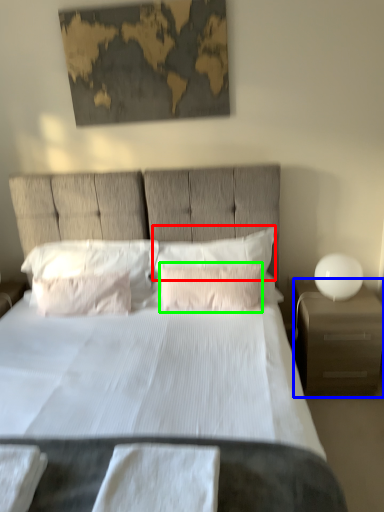
Question: Which object is positioned farthest from pillow (highlighted by a red box)? Select from nightstand (highlighted by a blue box) and pillow (highlighted by a green box).

Choices:
 (A) nightstand
 (B) pillow

Answer: (A)